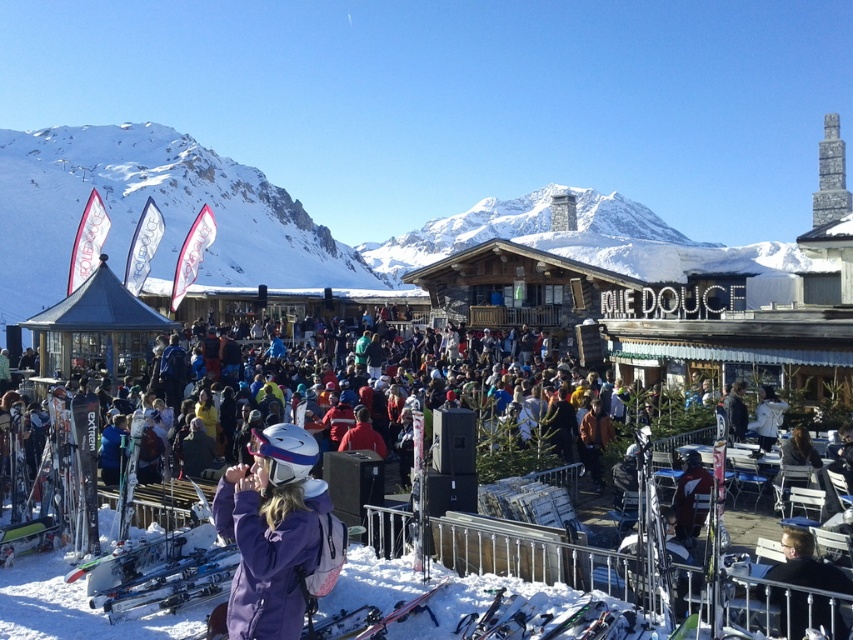
Question: Can you confirm if purple matte jacket at center is positioned below light brown leather jacket at lower right?

Choices:
 (A) yes
 (B) no

Answer: (B)

Question: Which of the following is the farthest from the observer?

Choices:
 (A) purple fabric jacket at center
 (B) light brown leather jacket at lower right

Answer: (B)

Question: Estimate the real-world distances between objects in this image. Which object is closer to the purple matte jacket at center?

Choices:
 (A) light brown leather jacket at lower right
 (B) purple fabric jacket at center

Answer: (B)

Question: Which of the following is the farthest from the observer?

Choices:
 (A) light brown leather jacket at lower right
 (B) purple fabric jacket at center
 (C) purple matte jacket at center

Answer: (A)

Question: In this image, where is purple fabric jacket at center located relative to purple matte jacket at center?

Choices:
 (A) above
 (B) below

Answer: (A)

Question: Considering the relative positions of purple fabric jacket at center and light brown leather jacket at lower right in the image provided, where is purple fabric jacket at center located with respect to light brown leather jacket at lower right?

Choices:
 (A) above
 (B) below

Answer: (A)